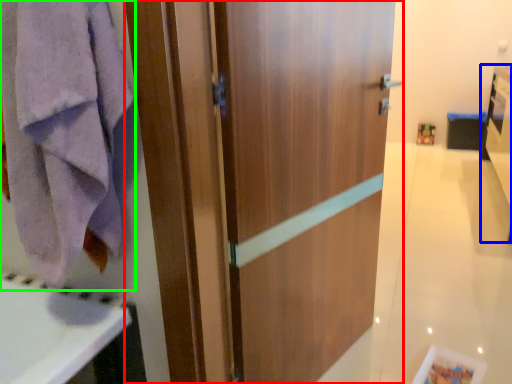
Question: Which object is positioned farthest from door (highlighted by a red box)? Select from vanity (highlighted by a blue box) and towel/napkin (highlighted by a green box).

Choices:
 (A) vanity
 (B) towel/napkin

Answer: (A)